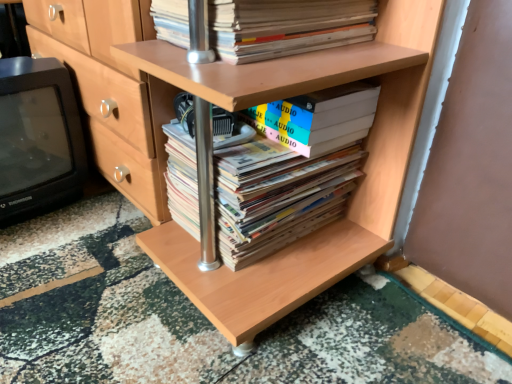
Question: From the image's perspective, does hardcover books at center, which is the 3th book from top to bottom, appear lower than white matte book at center, the 2th book when ordered from top to bottom?

Choices:
 (A) yes
 (B) no

Answer: (A)

Question: Is hardcover books at center, which is the 3th book from top to bottom, positioned with its back to white matte book at center, the 2th book when ordered from top to bottom?

Choices:
 (A) no
 (B) yes

Answer: (A)

Question: Can we say hardcover books at center, which is the 3th book from top to bottom, lies outside white matte book at center, the second book from the bottom?

Choices:
 (A) yes
 (B) no

Answer: (A)

Question: Is the depth of hardcover books at center, which is the 3th book from top to bottom, less than that of white matte book at center, the second book from the bottom?

Choices:
 (A) no
 (B) yes

Answer: (B)

Question: Is hardcover books at center, which is the 3th book from top to bottom, taller than white matte book at center, the second book from the bottom?

Choices:
 (A) no
 (B) yes

Answer: (B)

Question: Is hardcover books at center, the 1th book when ordered from bottom to top, in front of or behind black plastic television at left in the image?

Choices:
 (A) front
 (B) behind

Answer: (A)

Question: Based on their positions, is hardcover books at center, which is the 3th book from top to bottom, located to the left or right of black plastic television at left?

Choices:
 (A) right
 (B) left

Answer: (A)

Question: In terms of width, does hardcover books at center, which is the 3th book from top to bottom, look wider or thinner when compared to black plastic television at left?

Choices:
 (A) wide
 (B) thin

Answer: (B)

Question: Is hardcover books at center, which is the 3th book from top to bottom, taller or shorter than black plastic television at left?

Choices:
 (A) tall
 (B) short

Answer: (B)

Question: From a real-world perspective, is matte cardboard book at upper center, which ranks as the 1th book in top-to-bottom order, positioned above or below hardcover books at center, the 1th book when ordered from bottom to top?

Choices:
 (A) below
 (B) above

Answer: (B)

Question: From the image's perspective, is matte cardboard book at upper center, which is counted as the 3th book, starting from the bottom, above or below hardcover books at center, which is the 3th book from top to bottom?

Choices:
 (A) below
 (B) above

Answer: (B)

Question: Is point [x=304, y=36] positioned closer to the camera than point [x=328, y=152]?

Choices:
 (A) farther
 (B) closer

Answer: (B)

Question: Is matte cardboard book at upper center, which is counted as the 3th book, starting from the bottom, inside the boundaries of hardcover books at center, the 1th book when ordered from bottom to top, or outside?

Choices:
 (A) inside
 (B) outside

Answer: (B)

Question: In the image, is matte cardboard book at upper center, which is counted as the 3th book, starting from the bottom, on the left side or the right side of black plastic television at left?

Choices:
 (A) left
 (B) right

Answer: (B)

Question: Considering their positions, is matte cardboard book at upper center, which ranks as the 1th book in top-to-bottom order, located in front of or behind black plastic television at left?

Choices:
 (A) behind
 (B) front

Answer: (B)